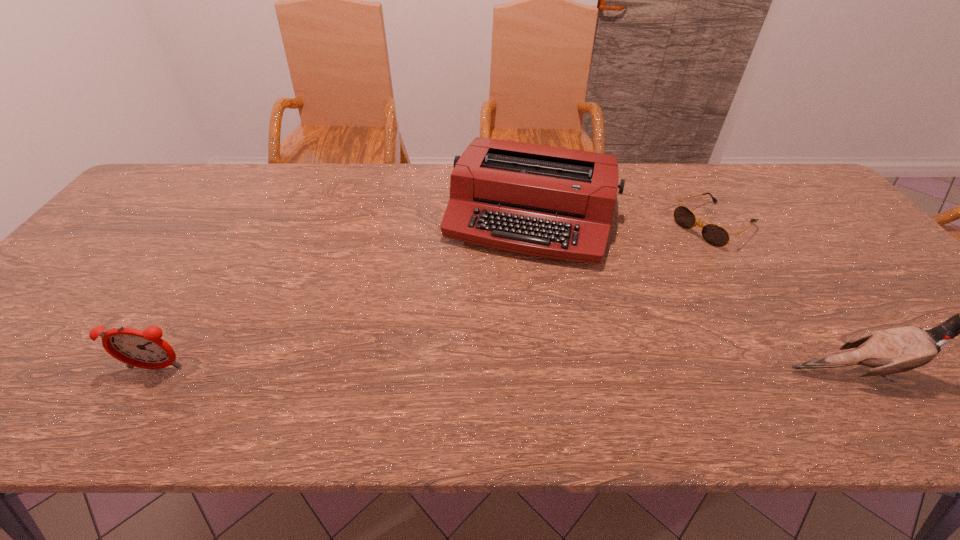
In order to click on alarm clock in this screenshot , I will do `click(145, 349)`.

The width and height of the screenshot is (960, 540). Identify the location of the tallest object. (896, 350).

Find the location of `the second object from left to right`. the second object from left to right is located at coordinates (545, 201).

This screenshot has height=540, width=960. I want to click on sunglasses, so click(x=715, y=235).

I want to click on vacant space located 0.070m at the face of the tallest object, so click(954, 372).

This screenshot has width=960, height=540. Identify the location of free location located 0.090m on the typing side of the typewriter. (503, 293).

Find the location of `free spot located on the typing side of the typewriter`. free spot located on the typing side of the typewriter is located at coordinates (501, 299).

I want to click on blank area located 0.300m on the typing side of the typewriter, so click(480, 362).

The width and height of the screenshot is (960, 540). Identify the location of vacant space located 0.290m on the lenses of the sunglasses. (617, 285).

Locate an element on the screen. Image resolution: width=960 pixels, height=540 pixels. free space located 0.260m on the lenses of the sunglasses is located at coordinates (626, 280).